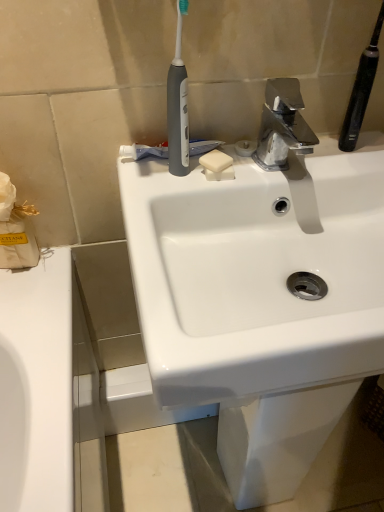
Question: Is the depth of white paper tissue at left greater than that of polished chrome faucet at upper center?

Choices:
 (A) yes
 (B) no

Answer: (A)

Question: Is white paper tissue at left shorter than polished chrome faucet at upper center?

Choices:
 (A) yes
 (B) no

Answer: (B)

Question: Considering the relative positions of white paper tissue at left and polished chrome faucet at upper center in the image provided, is white paper tissue at left to the right of polished chrome faucet at upper center from the viewer's perspective?

Choices:
 (A) no
 (B) yes

Answer: (A)

Question: Is white paper tissue at left looking in the opposite direction of polished chrome faucet at upper center?

Choices:
 (A) yes
 (B) no

Answer: (B)

Question: Is white paper tissue at left bigger than polished chrome faucet at upper center?

Choices:
 (A) yes
 (B) no

Answer: (A)

Question: Is polished chrome faucet at upper center wider or thinner than white matte toothpaste at center?

Choices:
 (A) wide
 (B) thin

Answer: (A)

Question: Considering their positions, is polished chrome faucet at upper center located in front of or behind white matte toothpaste at center?

Choices:
 (A) front
 (B) behind

Answer: (A)

Question: Is point (289, 110) closer or farther from the camera than point (211, 145)?

Choices:
 (A) closer
 (B) farther

Answer: (B)

Question: From a real-world perspective, is polished chrome faucet at upper center above or below white matte toothpaste at center?

Choices:
 (A) above
 (B) below

Answer: (A)

Question: Considering the positions of point (334, 326) and point (354, 144), is point (334, 326) closer or farther from the camera than point (354, 144)?

Choices:
 (A) farther
 (B) closer

Answer: (B)

Question: Based on their positions, is white glossy sink at center located to the left or right of black rubberized toothbrush at upper right, placed as the 2th toothbrush when sorted from left to right?

Choices:
 (A) left
 (B) right

Answer: (A)

Question: Is white glossy sink at center wider or thinner than black rubberized toothbrush at upper right, placed as the 2th toothbrush when sorted from left to right?

Choices:
 (A) thin
 (B) wide

Answer: (B)

Question: From a real-world perspective, is white glossy sink at center physically located above or below black rubberized toothbrush at upper right, arranged as the 1th toothbrush when viewed from the right?

Choices:
 (A) above
 (B) below

Answer: (B)

Question: From a real-world perspective, is white glossy sink at center positioned above or below white matte soap at center?

Choices:
 (A) below
 (B) above

Answer: (A)

Question: Considering the positions of white glossy sink at center and white matte soap at center in the image, is white glossy sink at center bigger or smaller than white matte soap at center?

Choices:
 (A) small
 (B) big

Answer: (B)